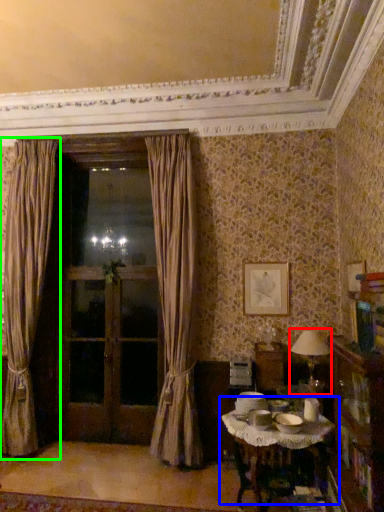
Question: Which object is the closest to the table lamp (highlighted by a red box)? Choose among these: table (highlighted by a blue box) or curtain (highlighted by a green box).

Choices:
 (A) table
 (B) curtain

Answer: (A)